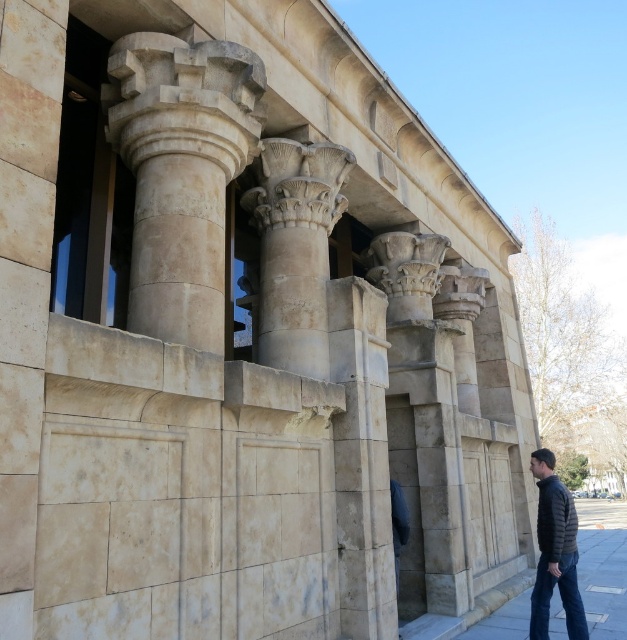
You are standing in front of the classical building and want to determine the position of two points marked on the facade. Which of the two points, point (564, 515) or point (582, 621), is closer to you?

Point (564, 515) is closer to you because it is further to the camera than point (582, 621).

Based on the photo, you are an architect examining the classical building. You notice the beige stone column at center and the dark gray quilted jacket at lower right. Which object is bigger in size?

The beige stone column at center is larger in size than the dark gray quilted jacket at lower right.